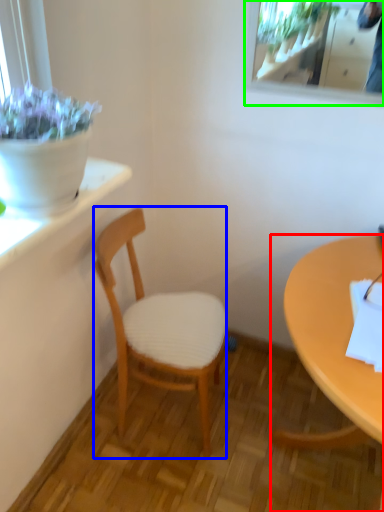
Question: Based on their relative distances, which object is farther from desk (highlighted by a red box)? Choose from chair (highlighted by a blue box) and mirror (highlighted by a green box).

Choices:
 (A) chair
 (B) mirror

Answer: (B)